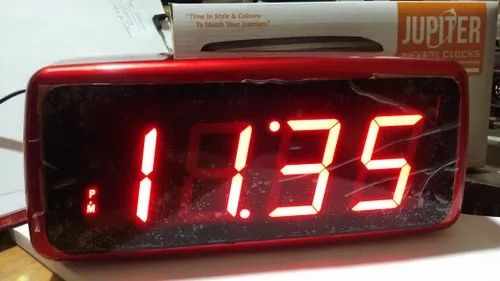
Locate an element on the screen. The height and width of the screenshot is (281, 500). electrical cable is located at coordinates (7, 96).